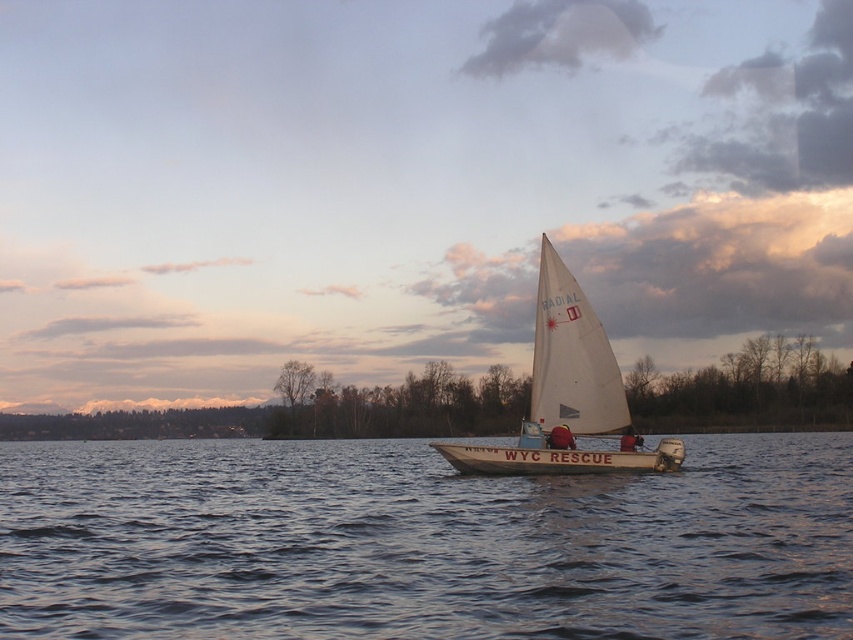
You are a sailor planning to navigate a small dinghy through the area between the clear water at center and the white sailboat at center. Based on the scene, can you estimate whether the space between them is wide enough for your dinghy, which is 2 meters wide?

The clear water at center might be wider than white sailboat at center, so the space between them could potentially accommodate a 2 meter wide dinghy. However, without exact measurements, this is an estimate and caution is advised.

You are a sailor on the white sailboat at center. You notice a red fabric jacket at center floating nearby. If the jacket is 6.39 feet away, can you reach it with a 6.5 foot long pole?

The white sailboat at center is 6.39 feet from the red fabric jacket at center. Since the pole is 6.5 feet long, which is slightly longer than the distance, you can reach the jacket with the pole.